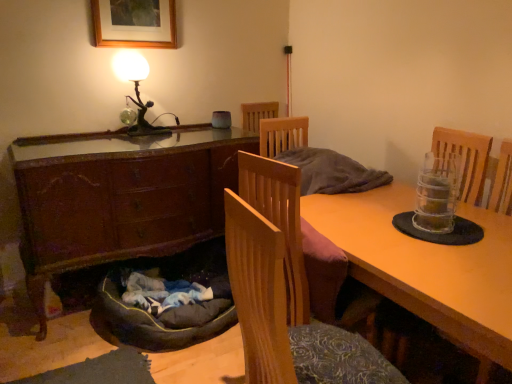
Describe the element at coordinates (134, 23) in the screenshot. I see `wooden picture frame at upper center` at that location.

What is the approximate height of wooden chair at center?

wooden chair at center is 31.83 inches tall.

What is the approximate height of metallic figure at upper left?

metallic figure at upper left is 19.02 inches tall.

What do you see at coordinates (426, 265) in the screenshot? I see `wooden desk at center` at bounding box center [426, 265].

Locate an element on the screen. wooden picture frame at upper center is located at coordinates (134, 23).

Does metallic figure at upper left appear on the left side of wooden desk at center?

Yes, metallic figure at upper left is to the left of wooden desk at center.

From a real-world perspective, is metallic figure at upper left positioned above or below wooden desk at center?

In terms of real-world spatial position, metallic figure at upper left is above wooden desk at center.

How many degrees apart are the facing directions of metallic figure at upper left and wooden desk at center?

87.1 degrees.

Is metallic figure at upper left turned away from wooden desk at center?

That's not correct — metallic figure at upper left is not looking away from wooden desk at center.

Does wooden desk at center come behind wooden chair at center?

Yes, it is behind wooden chair at center.

Which is more to the right, wooden desk at center or wooden chair at center?

Positioned to the right is wooden desk at center.

Is wooden desk at center aimed at wooden chair at center?

Yes, wooden desk at center faces towards wooden chair at center.

Is wooden desk at center far away from wooden chair at center?

That's not correct — wooden desk at center is a little close to wooden chair at center.

Is there a large distance between dark gray fabric dog bed at lower left and wooden chair at center?

Absolutely, dark gray fabric dog bed at lower left is distant from wooden chair at center.

Looking at this image, does dark gray fabric dog bed at lower left lie in front of wooden chair at center?

No, it is not.

Between dark gray fabric dog bed at lower left and wooden chair at center, which one has less height?

Standing shorter between the two is dark gray fabric dog bed at lower left.

Which of these two, wooden picture frame at upper center or wooden cabinet at lower left, is bigger?

wooden cabinet at lower left.

Find the location of a particular element. picture frame behind the wooden cabinet at lower left is located at coordinates (134, 23).

Considering the positions of point (166, 44) and point (106, 228), is point (166, 44) closer or farther from the camera than point (106, 228)?

Clearly, point (166, 44) is more distant from the camera than point (106, 228).

From a real-world perspective, who is located higher, wooden picture frame at upper center or wooden cabinet at lower left?

In real-world perspective, wooden picture frame at upper center is above.

Locate an element on the screen. This screenshot has height=384, width=512. table lamp behind the wooden chair at center is located at coordinates (136, 90).

Is metallic figure at upper left facing away from wooden chair at center?

No.

From a real-world perspective, is metallic figure at upper left above or below wooden chair at center?

metallic figure at upper left is situated higher than wooden chair at center in the real world.

Between metallic figure at upper left and wooden chair at center, which one appears on the right side from the viewer's perspective?

Positioned to the right is wooden chair at center.

Looking at this image, from a real-world perspective, which is physically above, wooden cabinet at lower left or wooden picture frame at upper center?

wooden picture frame at upper center.

Between wooden cabinet at lower left and wooden picture frame at upper center, which one appears on the left side from the viewer's perspective?

wooden picture frame at upper center is more to the left.

Is wooden cabinet at lower left bigger or smaller than wooden picture frame at upper center?

Clearly, wooden cabinet at lower left is larger in size than wooden picture frame at upper center.

From a real-world perspective, is wooden desk at center physically above metallic figure at upper left?

No.

Is wooden desk at center facing away from metallic figure at upper left?

No, metallic figure at upper left is not at the back of wooden desk at center.

In the scene shown: Considering the relative sizes of wooden desk at center and metallic figure at upper left in the image provided, is wooden desk at center taller than metallic figure at upper left?

Yes.

This screenshot has height=384, width=512. What are the coordinates of `desk that appears below the metallic figure at upper left (from the image's perspective)` in the screenshot? It's located at (426, 265).

At what (x,y) coordinates should I click in order to perform the action: click on table lamp above the wooden desk at center (from a real-world perspective). Please return your answer as a coordinate pair (x, y). This screenshot has height=384, width=512. Looking at the image, I should click on (136, 90).

Identify the location of desk lying behind the wooden chair at center. Image resolution: width=512 pixels, height=384 pixels. (426, 265).

Which object lies further to the anchor point wooden chair at center, metallic figure at upper left or dark gray fabric dog bed at lower left?

metallic figure at upper left is positioned further to the anchor wooden chair at center.

Estimate the real-world distances between objects in this image. Which object is further from dark gray fabric dog bed at lower left, metallic figure at upper left or wooden chair at center?

Among the two, wooden chair at center is located further to dark gray fabric dog bed at lower left.

Based on the photo, looking at the image, which one is located closer to wooden desk at center, metallic figure at upper left or dark gray fabric dog bed at lower left?

dark gray fabric dog bed at lower left lies closer to wooden desk at center than the other object.

Looking at the image, which one is located closer to wooden picture frame at upper center, wooden cabinet at lower left or metallic figure at upper left?

Among the two, metallic figure at upper left is located nearer to wooden picture frame at upper center.

Which object lies nearer to the anchor point wooden desk at center, metallic figure at upper left or wooden cabinet at lower left?

wooden cabinet at lower left lies closer to wooden desk at center than the other object.

Considering their positions, is wooden desk at center positioned further to wooden chair at center than dark gray fabric dog bed at lower left?

dark gray fabric dog bed at lower left lies further to wooden chair at center than the other object.

Based on their spatial positions, is wooden cabinet at lower left or metallic figure at upper left further from wooden chair at center?

Based on the image, metallic figure at upper left appears to be further to wooden chair at center.

Looking at the image, which one is located further to dark gray fabric dog bed at lower left, wooden desk at center or metallic figure at upper left?

wooden desk at center.

Identify the location of cabinetry between wooden chair at center and wooden picture frame at upper center in the front-back direction. The height and width of the screenshot is (384, 512). (121, 199).

Where is `chair between wooden picture frame at upper center and dark gray fabric dog bed at lower left from top to bottom`? chair between wooden picture frame at upper center and dark gray fabric dog bed at lower left from top to bottom is located at coordinates (286, 316).

This screenshot has width=512, height=384. Identify the location of picture frame located between wooden desk at center and metallic figure at upper left in the depth direction. (134, 23).

Image resolution: width=512 pixels, height=384 pixels. I want to click on dog bed between wooden chair at center and metallic figure at upper left along the z-axis, so click(x=168, y=309).